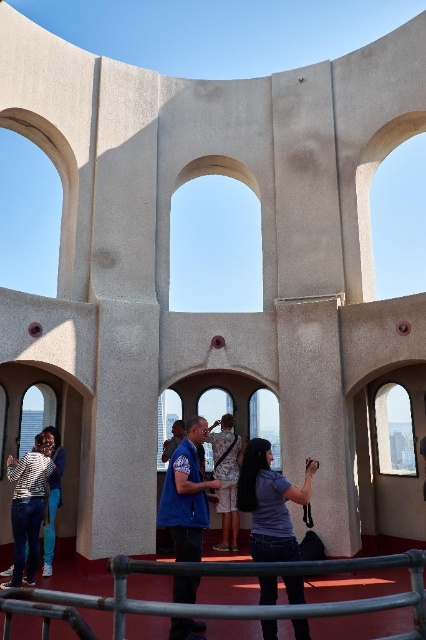
Is point (199, 605) less distant than point (221, 506)?

Yes, point (199, 605) is closer to viewer.

Who is lower down, metallic gray railing at lower center or camouflage-patterned dress at center?

metallic gray railing at lower center is below.

Where is `metallic gray railing at lower center`? The image size is (426, 640). metallic gray railing at lower center is located at coordinates (227, 604).

Looking at this image, does blue fabric shirt at center have a greater height compared to camouflage-patterned dress at center?

Yes.

Which is in front, point (166, 483) or point (218, 456)?

Point (166, 483)

I want to click on blue fabric shirt at center, so click(187, 493).

Can you confirm if matte blue shirt at center is positioned to the right of blue fabric shirt at center?

Indeed, matte blue shirt at center is positioned on the right side of blue fabric shirt at center.

Find the location of a particular element. The height and width of the screenshot is (640, 426). matte blue shirt at center is located at coordinates (270, 502).